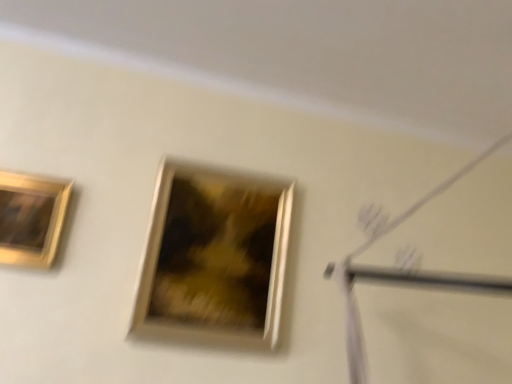
The image size is (512, 384). What do you see at coordinates (31, 218) in the screenshot?
I see `gold metallic picture frame at upper left, which is counted as the second picture frame, starting from the right` at bounding box center [31, 218].

Where is `gold metallic picture frame at upper left, which is the 1th picture frame in left-to-right order`? gold metallic picture frame at upper left, which is the 1th picture frame in left-to-right order is located at coordinates (31, 218).

Consider the image. In order to face gold metallic picture frame at upper left, which is the 1th picture frame in left-to-right order, should I rotate leftwards or rightwards?

Turn left by 30.362 degrees to look at gold metallic picture frame at upper left, which is the 1th picture frame in left-to-right order.

You are a GUI agent. You are given a task and a screenshot of the screen. Output one action in this format:
    pyautogui.click(x=<x>, y=<y>)
    Task: Click on the gold metallic picture frame at center, arranged as the second picture frame when viewed from the left
    
    Given the screenshot: What is the action you would take?
    pyautogui.click(x=214, y=258)

How much space does gold metallic picture frame at center, arranged as the first picture frame when viewed from the right, occupy horizontally?

It is 7.85 centimeters.

What do you see at coordinates (214, 258) in the screenshot?
I see `gold metallic picture frame at center, arranged as the second picture frame when viewed from the left` at bounding box center [214, 258].

You are a GUI agent. You are given a task and a screenshot of the screen. Output one action in this format:
    pyautogui.click(x=<x>, y=<y>)
    Task: Click on the gold metallic picture frame at upper left, which is counted as the second picture frame, starting from the right
    The image size is (512, 384).
    Given the screenshot: What is the action you would take?
    pyautogui.click(x=31, y=218)

Based on their positions, is gold metallic picture frame at upper left, which is the 1th picture frame in left-to-right order, located to the left or right of gold metallic picture frame at center, arranged as the first picture frame when viewed from the right?

In the image, gold metallic picture frame at upper left, which is the 1th picture frame in left-to-right order, appears on the left side of gold metallic picture frame at center, arranged as the first picture frame when viewed from the right.

Who is more distant, gold metallic picture frame at upper left, which is counted as the second picture frame, starting from the right, or gold metallic picture frame at center, arranged as the second picture frame when viewed from the left?

gold metallic picture frame at center, arranged as the second picture frame when viewed from the left, is more distant.

Is point (50, 264) closer or farther from the camera than point (159, 175)?

Point (50, 264) is positioned closer to the camera compared to point (159, 175).

From the image's perspective, is gold metallic picture frame at upper left, which is the 1th picture frame in left-to-right order, positioned above or below gold metallic picture frame at center, arranged as the second picture frame when viewed from the left?

gold metallic picture frame at upper left, which is the 1th picture frame in left-to-right order, is above gold metallic picture frame at center, arranged as the second picture frame when viewed from the left.

From a real-world perspective, which object rests below the other?

gold metallic picture frame at center, arranged as the second picture frame when viewed from the left, is physically lower.

Between gold metallic picture frame at upper left, which is counted as the second picture frame, starting from the right, and gold metallic picture frame at center, arranged as the first picture frame when viewed from the right, which one has larger width?

gold metallic picture frame at center, arranged as the first picture frame when viewed from the right, is wider.

Looking at this image, which of these two, gold metallic picture frame at upper left, which is counted as the second picture frame, starting from the right, or gold metallic picture frame at center, arranged as the first picture frame when viewed from the right, stands shorter?

gold metallic picture frame at upper left, which is counted as the second picture frame, starting from the right.

Is gold metallic picture frame at upper left, which is counted as the second picture frame, starting from the right, smaller than gold metallic picture frame at center, arranged as the second picture frame when viewed from the left?

Yes, gold metallic picture frame at upper left, which is counted as the second picture frame, starting from the right, is smaller than gold metallic picture frame at center, arranged as the second picture frame when viewed from the left.

Looking at this image, is gold metallic picture frame at upper left, which is the 1th picture frame in left-to-right order, positioned beyond the bounds of gold metallic picture frame at center, arranged as the first picture frame when viewed from the right?

gold metallic picture frame at upper left, which is the 1th picture frame in left-to-right order, lies outside gold metallic picture frame at center, arranged as the first picture frame when viewed from the right,'s area.

Is gold metallic picture frame at upper left, which is the 1th picture frame in left-to-right order, in contact with gold metallic picture frame at center, arranged as the first picture frame when viewed from the right?

There is a gap between gold metallic picture frame at upper left, which is the 1th picture frame in left-to-right order, and gold metallic picture frame at center, arranged as the first picture frame when viewed from the right.

Could you tell me if gold metallic picture frame at upper left, which is the 1th picture frame in left-to-right order, is turned towards gold metallic picture frame at center, arranged as the second picture frame when viewed from the left?

No, gold metallic picture frame at upper left, which is the 1th picture frame in left-to-right order, is not turned towards gold metallic picture frame at center, arranged as the second picture frame when viewed from the left.

How different are the orientations of gold metallic picture frame at upper left, which is the 1th picture frame in left-to-right order, and gold metallic picture frame at center, arranged as the second picture frame when viewed from the left, in degrees?

The facing directions of gold metallic picture frame at upper left, which is the 1th picture frame in left-to-right order, and gold metallic picture frame at center, arranged as the second picture frame when viewed from the left, are 0.49 degrees apart.

Measure the distance between gold metallic picture frame at upper left, which is the 1th picture frame in left-to-right order, and gold metallic picture frame at center, arranged as the first picture frame when viewed from the right.

gold metallic picture frame at upper left, which is the 1th picture frame in left-to-right order, and gold metallic picture frame at center, arranged as the first picture frame when viewed from the right, are 18.64 inches apart.

Locate an element on the screen. Image resolution: width=512 pixels, height=384 pixels. picture frame above the gold metallic picture frame at center, arranged as the first picture frame when viewed from the right (from the image's perspective) is located at coordinates (31, 218).

Is gold metallic picture frame at center, arranged as the first picture frame when viewed from the right, to the left or to the right of gold metallic picture frame at upper left, which is the 1th picture frame in left-to-right order, in the image?

Based on their positions, gold metallic picture frame at center, arranged as the first picture frame when viewed from the right, is located to the right of gold metallic picture frame at upper left, which is the 1th picture frame in left-to-right order.

Which object is closer to the camera, gold metallic picture frame at center, arranged as the second picture frame when viewed from the left, or gold metallic picture frame at upper left, which is the 1th picture frame in left-to-right order?

Positioned in front is gold metallic picture frame at upper left, which is the 1th picture frame in left-to-right order.

Does point (177, 290) come in front of point (18, 234)?

No, it is behind (18, 234).

From the image's perspective, does gold metallic picture frame at center, arranged as the second picture frame when viewed from the left, appear lower than gold metallic picture frame at upper left, which is counted as the second picture frame, starting from the right?

Correct, gold metallic picture frame at center, arranged as the second picture frame when viewed from the left, appears lower than gold metallic picture frame at upper left, which is counted as the second picture frame, starting from the right, in the image.

From a real-world perspective, which is physically below, gold metallic picture frame at center, arranged as the second picture frame when viewed from the left, or gold metallic picture frame at upper left, which is counted as the second picture frame, starting from the right?

In real-world perspective, gold metallic picture frame at center, arranged as the second picture frame when viewed from the left, is lower.

Which of these two, gold metallic picture frame at center, arranged as the first picture frame when viewed from the right, or gold metallic picture frame at upper left, which is the 1th picture frame in left-to-right order, is thinner?

gold metallic picture frame at upper left, which is the 1th picture frame in left-to-right order, is thinner.

Considering the sizes of objects gold metallic picture frame at center, arranged as the first picture frame when viewed from the right, and gold metallic picture frame at upper left, which is the 1th picture frame in left-to-right order, in the image provided, who is taller, gold metallic picture frame at center, arranged as the first picture frame when viewed from the right, or gold metallic picture frame at upper left, which is the 1th picture frame in left-to-right order,?

Standing taller between the two is gold metallic picture frame at center, arranged as the first picture frame when viewed from the right.

Is gold metallic picture frame at center, arranged as the second picture frame when viewed from the left, bigger than gold metallic picture frame at upper left, which is the 1th picture frame in left-to-right order?

Yes.

Can we say gold metallic picture frame at center, arranged as the second picture frame when viewed from the left, lies outside gold metallic picture frame at upper left, which is the 1th picture frame in left-to-right order?

gold metallic picture frame at center, arranged as the second picture frame when viewed from the left, lies outside gold metallic picture frame at upper left, which is the 1th picture frame in left-to-right order,'s area.

Are gold metallic picture frame at center, arranged as the first picture frame when viewed from the right, and gold metallic picture frame at upper left, which is the 1th picture frame in left-to-right order, beside each other?

They are not placed beside each other.

Is gold metallic picture frame at center, arranged as the first picture frame when viewed from the right, facing towards gold metallic picture frame at upper left, which is the 1th picture frame in left-to-right order?

No, gold metallic picture frame at center, arranged as the first picture frame when viewed from the right, does not turn towards gold metallic picture frame at upper left, which is the 1th picture frame in left-to-right order.

How distant is gold metallic picture frame at center, arranged as the first picture frame when viewed from the right, from gold metallic picture frame at upper left, which is counted as the second picture frame, starting from the right?

A distance of 18.64 inches exists between gold metallic picture frame at center, arranged as the first picture frame when viewed from the right, and gold metallic picture frame at upper left, which is counted as the second picture frame, starting from the right.

Locate an element on the screen. The width and height of the screenshot is (512, 384). picture frame that appears below the gold metallic picture frame at upper left, which is the 1th picture frame in left-to-right order (from a real-world perspective) is located at coordinates (214, 258).

Locate an element on the screen. picture frame directly beneath the gold metallic picture frame at upper left, which is counted as the second picture frame, starting from the right (from a real-world perspective) is located at coordinates (214, 258).

This screenshot has width=512, height=384. Identify the location of picture frame above the gold metallic picture frame at center, arranged as the first picture frame when viewed from the right (from the image's perspective). (31, 218).